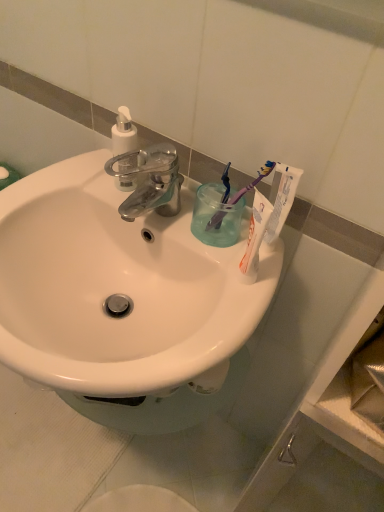
At what (x,y) coordinates should I click in order to perform the action: click on vacant space in front of white matte toothpaste at upper right. Please return your answer as a coordinate pair (x, y). Looking at the image, I should click on (237, 308).